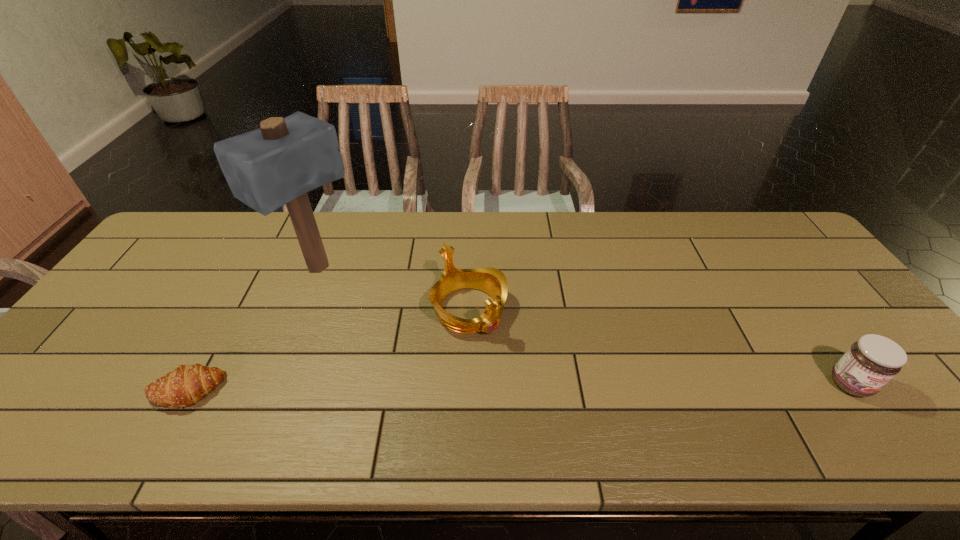
Find the location of a particular element. vacant region located at the front emblem of the tiara is located at coordinates (539, 394).

Where is `object that is at the far edge`? This screenshot has width=960, height=540. object that is at the far edge is located at coordinates (277, 164).

Identify the location of crescent roll situated at the near edge. Image resolution: width=960 pixels, height=540 pixels. (184, 386).

Identify the location of jam that is at the near edge. The height and width of the screenshot is (540, 960). (870, 363).

In order to click on object at the right edge in this screenshot , I will do `click(870, 363)`.

Find the location of a particular element. Image resolution: width=960 pixels, height=540 pixels. object that is at the near right corner is located at coordinates (870, 363).

Where is `free space at the far edge`? The height and width of the screenshot is (540, 960). free space at the far edge is located at coordinates (224, 240).

Image resolution: width=960 pixels, height=540 pixels. I want to click on vacant space at the near edge, so click(x=646, y=404).

The width and height of the screenshot is (960, 540). In order to click on vacant point at the right edge in this screenshot , I will do `click(850, 331)`.

Find the location of `vacant space at the far right corner of the desktop`. vacant space at the far right corner of the desktop is located at coordinates (786, 230).